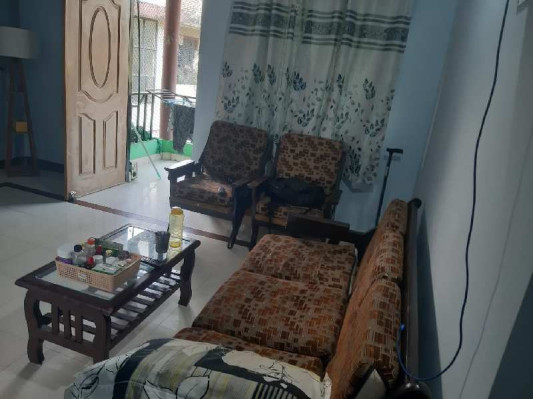
Identify the location of white floor. The width and height of the screenshot is (533, 399). (26, 211).